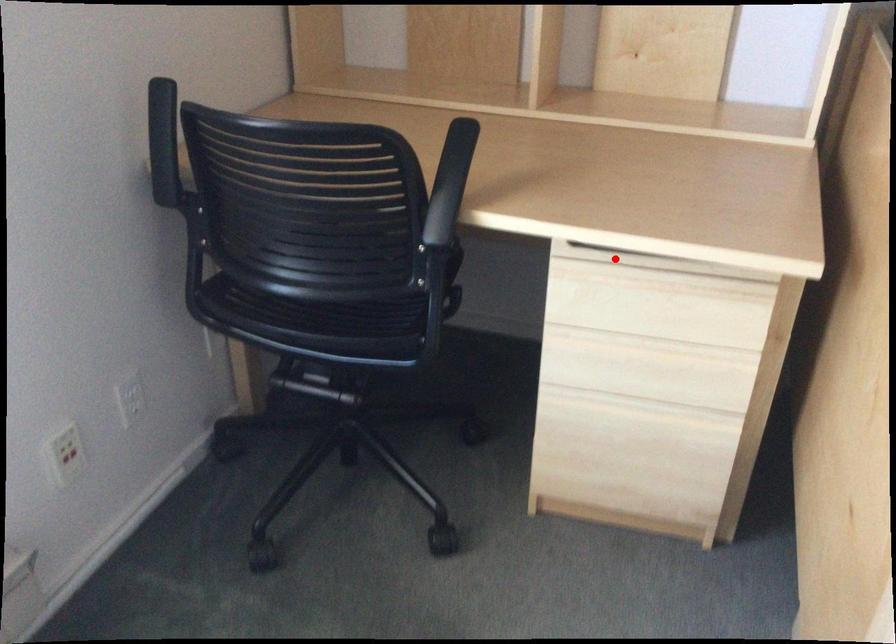
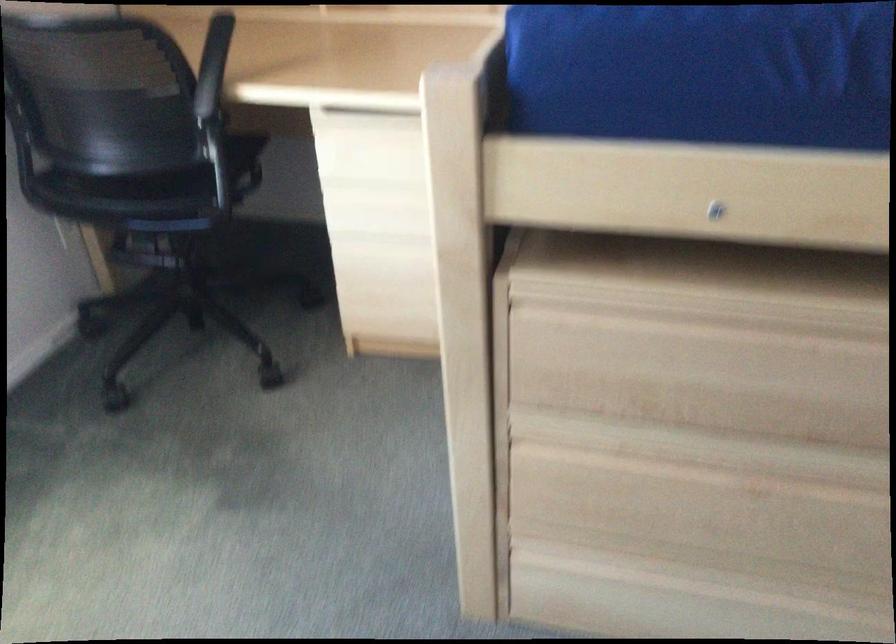
Find the pixel in the second image that matches the highlighted location in the first image.

(364, 117)